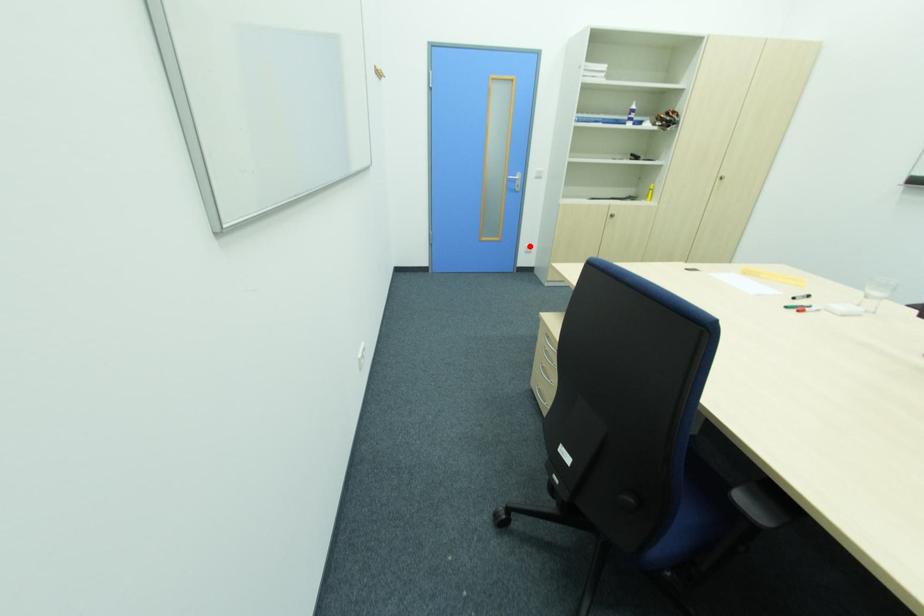
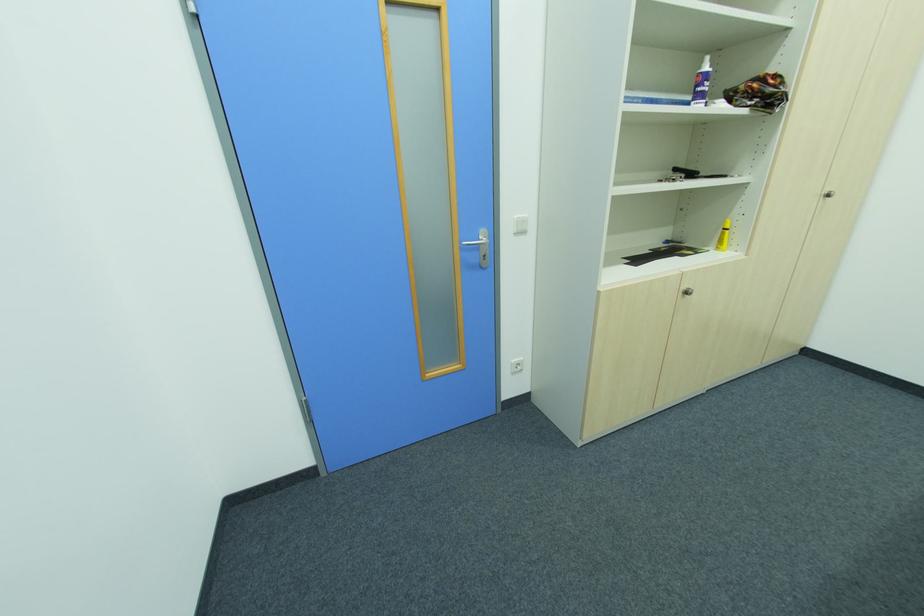
Question: I am providing you with two images of the same scene from different viewpoints. A red point is shown in image1. For the corresponding object point in image2, is it positioned nearer or farther from the camera?

Choices:
 (A) Nearer
 (B) Farther

Answer: (B)